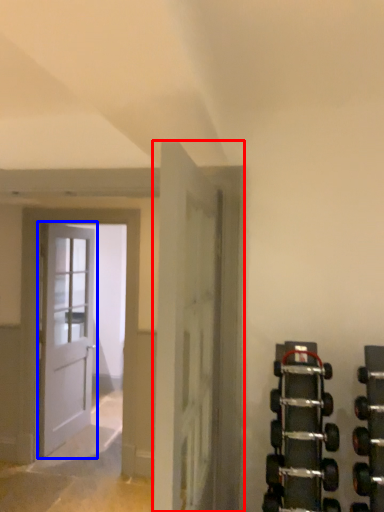
Question: Which object is further to the camera taking this photo, door (highlighted by a red box) or door (highlighted by a blue box)?

Choices:
 (A) door
 (B) door

Answer: (B)